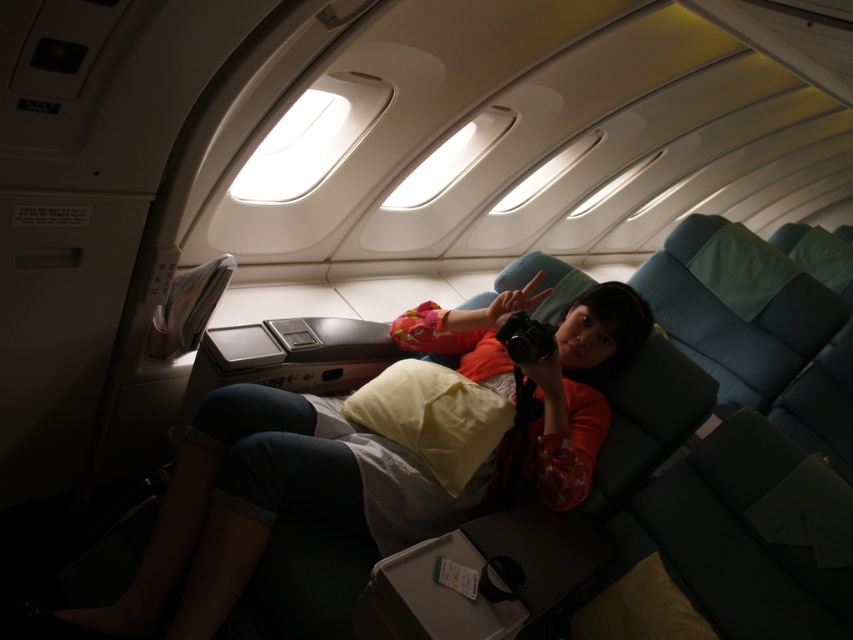
Question: Which of the following is the closest to the observer?

Choices:
 (A) matte orange shirt at center
 (B) yellow soft pillow at center

Answer: (A)

Question: Can you confirm if matte orange shirt at center is wider than yellow soft pillow at center?

Choices:
 (A) no
 (B) yes

Answer: (B)

Question: In this image, where is matte orange shirt at center located relative to yellow soft pillow at center?

Choices:
 (A) left
 (B) right

Answer: (A)

Question: Can you confirm if matte orange shirt at center is positioned below yellow soft pillow at center?

Choices:
 (A) yes
 (B) no

Answer: (A)

Question: Which point appears closest to the camera in this image?

Choices:
 (A) (190, 624)
 (B) (498, 403)

Answer: (A)